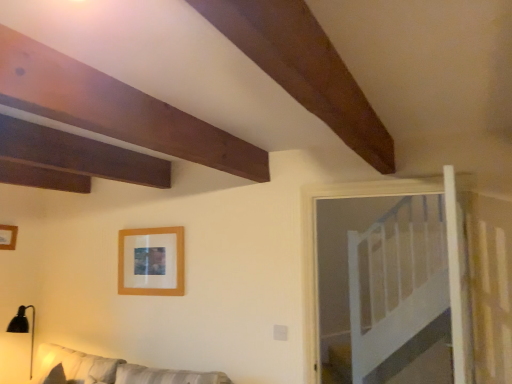
Question: Is white wooden bed at upper right inside the boundaries of wooden frame at upper center, positioned as the first picture frame in right-to-left order, or outside?

Choices:
 (A) inside
 (B) outside

Answer: (B)

Question: Looking at their shapes, would you say white wooden bed at upper right is wider or thinner than wooden frame at upper center, the 2th picture frame viewed from the left?

Choices:
 (A) wide
 (B) thin

Answer: (A)

Question: Considering the real-world distances, which object is closest to the wooden frame at upper center, the 2th picture frame viewed from the left?

Choices:
 (A) white wooden bed at upper right
 (B) white fabric couch at lower left
 (C) wooden frame at upper left, the second picture frame positioned from the right
 (D) black matte lamp at lower left

Answer: (B)

Question: Which is farther from the black matte lamp at lower left?

Choices:
 (A) white fabric couch at lower left
 (B) wooden frame at upper left, arranged as the first picture frame when viewed from the left
 (C) wooden frame at upper center, the 2th picture frame viewed from the left
 (D) white wooden bed at upper right

Answer: (D)